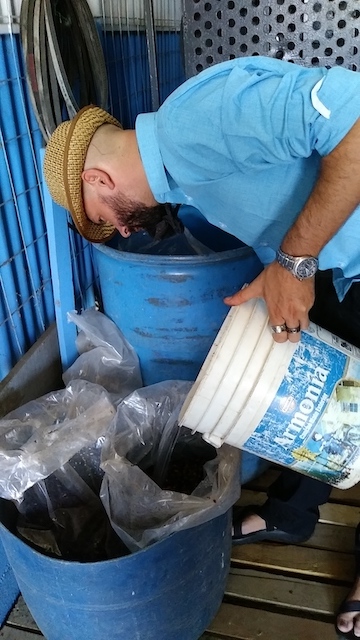
At what (x,y) coordinates should I click in order to perform the action: click on wooden floor. Please return your answer as a coordinate pair (x, y). Looking at the image, I should click on (268, 584).